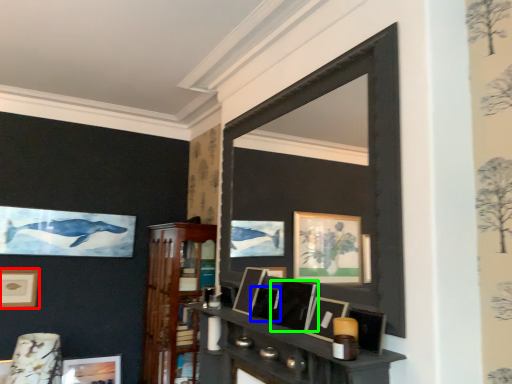
Question: Estimate the real-world distances between objects in this image. Which object is closer to picture frame (highlighted by a red box), picture frame (highlighted by a blue box) or picture frame (highlighted by a green box)?

Choices:
 (A) picture frame
 (B) picture frame

Answer: (A)